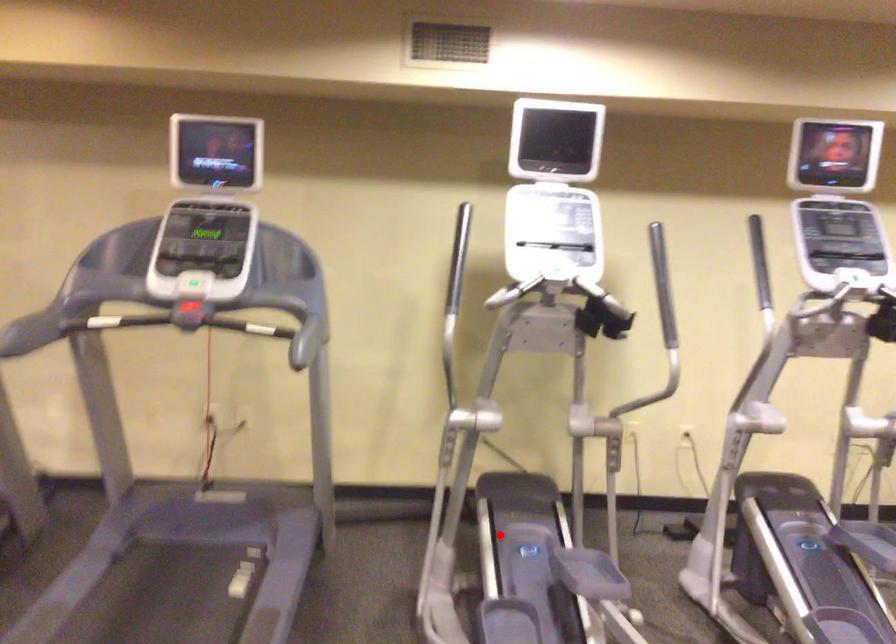
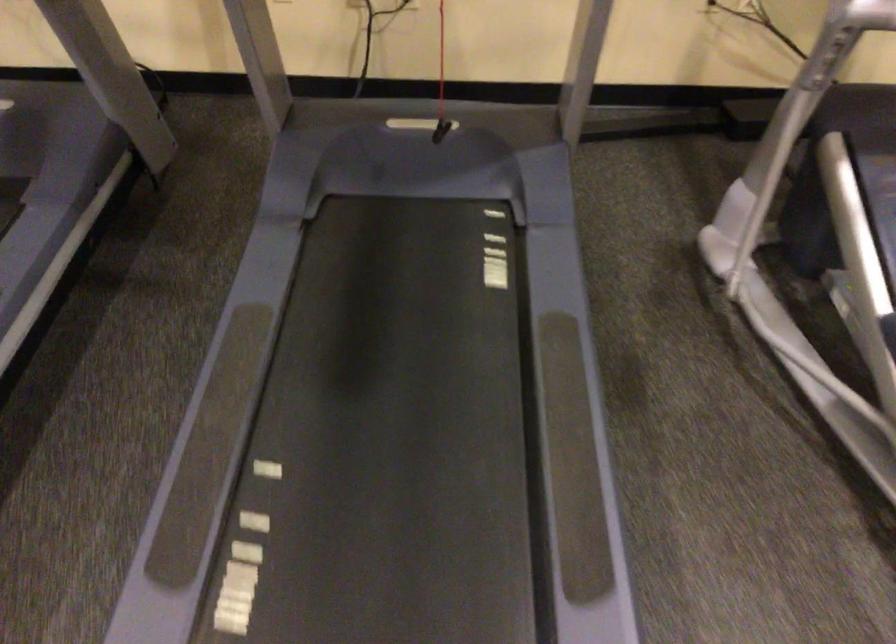
Question: I am providing you with two images of the same scene from different viewpoints. Given a red point in image1, look at the same physical point in image2. Is it:

Choices:
 (A) Closer to the viewpoint
 (B) Farther from the viewpoint

Answer: (A)